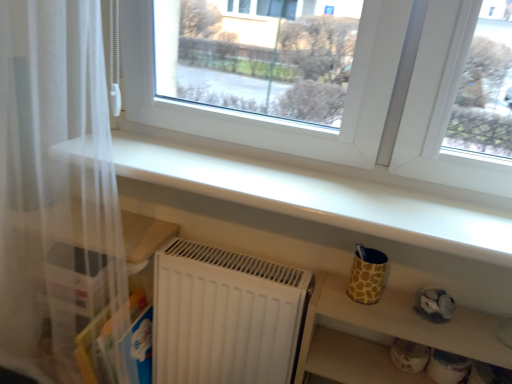
Question: From the image's perspective, is matte yellow cup at lower right, which is the 2th shelf from top to bottom, above or below white sheer curtain at left?

Choices:
 (A) below
 (B) above

Answer: (A)

Question: Which is correct: matte yellow cup at lower right, which is the 2th shelf from top to bottom, is inside white sheer curtain at left, or outside of it?

Choices:
 (A) outside
 (B) inside

Answer: (A)

Question: Which of these objects is positioned closest to the matte yellow cup at lower right, the 1th shelf ordered from the bottom?

Choices:
 (A) white glossy shelf at upper center, the 1th shelf in the top-to-bottom sequence
 (B) white sheer curtain at left

Answer: (A)

Question: Which of these objects is positioned farthest from the white sheer curtain at left?

Choices:
 (A) matte yellow cup at lower right, the 1th shelf ordered from the bottom
 (B) white glossy shelf at upper center, the 1th shelf in the top-to-bottom sequence

Answer: (A)